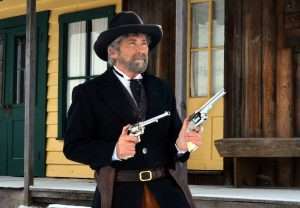
Locate an element on the screen. This screenshot has width=300, height=208. coat is located at coordinates (103, 107).